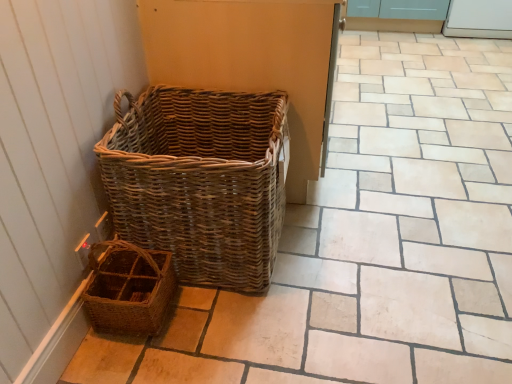
Identify the location of vacant area that lies in front of natural wicker picnic basket at left, placed as the second picnic basket when sorted from bottom to top. (236, 338).